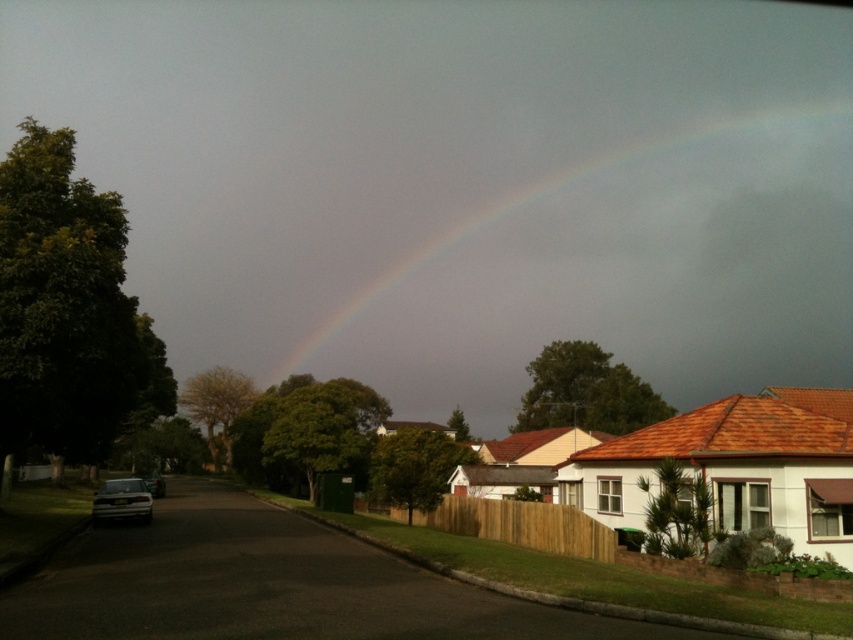
Question: Where is rainbow at upper center located in relation to silver metallic car at lower left in the image?

Choices:
 (A) below
 (B) above

Answer: (B)

Question: Where is rainbow at upper center located in relation to silver metallic car at lower left in the image?

Choices:
 (A) below
 (B) above

Answer: (B)

Question: Among these objects, which one is nearest to the camera?

Choices:
 (A) matte silver sedan at lower left
 (B) rainbow at upper center
 (C) silver metallic car at lower left

Answer: (A)

Question: Does matte silver sedan at lower left have a greater width compared to silver metallic car at lower left?

Choices:
 (A) no
 (B) yes

Answer: (A)

Question: Based on their relative distances, which object is nearer to the rainbow at upper center?

Choices:
 (A) silver metallic car at lower left
 (B) matte silver sedan at lower left

Answer: (A)

Question: Which point is closer to the camera taking this photo?

Choices:
 (A) (143, 516)
 (B) (730, 212)

Answer: (A)